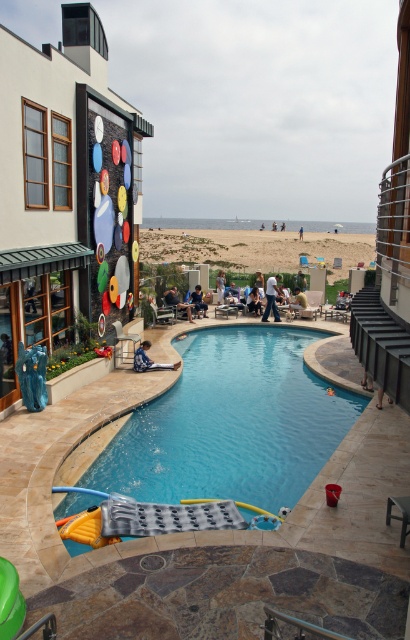
Question: Which point is closer to the camera?

Choices:
 (A) blue fabric chair at center
 (B) dark blue fabric chair at center

Answer: (B)

Question: Among these points, which one is nearest to the camera?

Choices:
 (A) (302, 284)
 (B) (255, 307)

Answer: (B)

Question: Can you confirm if blue denim jeans at center is positioned below light brown leather chair at center?

Choices:
 (A) yes
 (B) no

Answer: (A)

Question: Which of these objects is positioned closest to the blue denim shorts at lower left?

Choices:
 (A) blue denim jeans at center
 (B) light brown wooden chair at lower right
 (C) light brown leather chair at center
 (D) blue smooth pool at center

Answer: (D)

Question: Is light brown wooden chair at lower right thinner than blue fabric chair at center?

Choices:
 (A) no
 (B) yes

Answer: (B)

Question: Can you confirm if blue denim shorts at lower left is positioned to the right of green fabric chair at center?

Choices:
 (A) no
 (B) yes

Answer: (A)